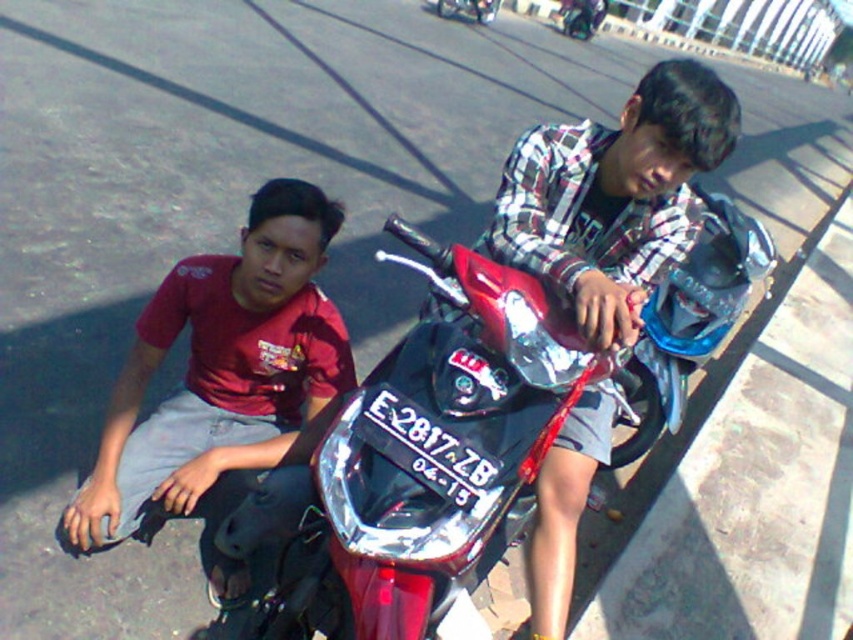
You are a pedestrian standing on the sidewalk next to the paved area where the shiny metallic motorcycle at center and the matte red shirt at left are located. You need to cross the road safely. Which object should you check first before stepping into the road?

You should check the shiny metallic motorcycle at center first because it is positioned to the right of the matte red shirt at left, meaning it is closer to the road, so you need to ensure it isn not moving before crossing.

You are a photographer positioned behind the shiny metallic motorcycle at center and the matte red shirt at left. You want to take a photo of the motorcycle without the shirt being in the frame. Is the motorcycle positioned in a way that allows you to capture it without the shirt blocking the view?

The shiny metallic motorcycle at center is closer to the viewer than the matte red shirt at left, so the motorcycle will block the view of the shirt. Therefore, you can take a photo of the motorcycle without the shirt being in the frame.